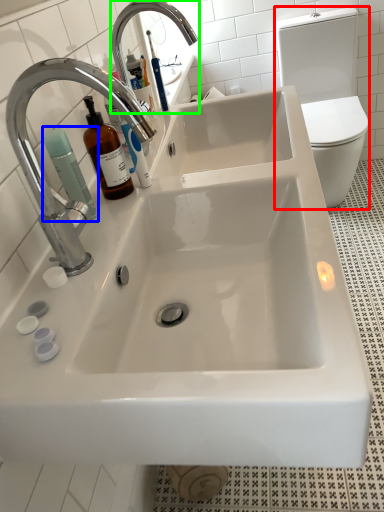
Question: Based on their relative distances, which object is farther from toilet bowl (highlighted by a red box)? Choose from cleaning product (highlighted by a blue box) and tap (highlighted by a green box).

Choices:
 (A) cleaning product
 (B) tap

Answer: (A)